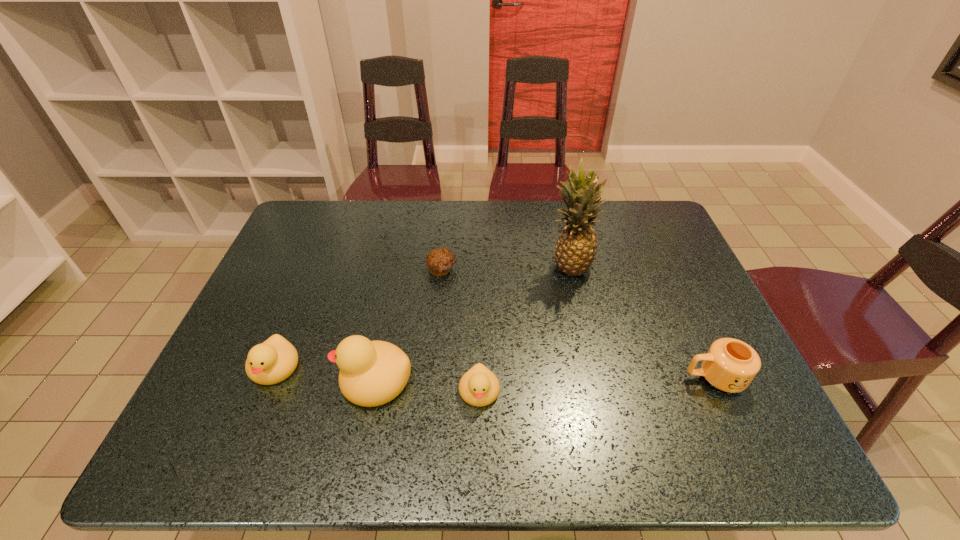
This screenshot has height=540, width=960. Find the location of `object present at the right edge`. object present at the right edge is located at coordinates (730, 365).

You are a GUI agent. You are given a task and a screenshot of the screen. Output one action in this format:
    pyautogui.click(x=<x>, y=<y>)
    Task: Click on the object that is at the near left corner
    
    Given the screenshot: What is the action you would take?
    pyautogui.click(x=273, y=361)

At what (x,y) coordinates should I click in order to perform the action: click on object present at the near right corner. Please return your answer as a coordinate pair (x, y). Looking at the image, I should click on (730, 365).

Locate an element on the screen. vacant point at the far edge is located at coordinates (352, 240).

Find the location of `vacant point at the near edge`. vacant point at the near edge is located at coordinates (586, 404).

Image resolution: width=960 pixels, height=540 pixels. In order to click on vacant space at the right edge of the desktop in this screenshot , I will do `click(650, 287)`.

Identify the location of unoccupied position between the muffin and the tallest object. This screenshot has height=540, width=960. (505, 268).

Find the location of a particular element. vacant space that is in between the second shortest object and the mug is located at coordinates (597, 384).

This screenshot has width=960, height=540. I want to click on free point between the shortest object and the leftmost duckling, so click(x=358, y=319).

The width and height of the screenshot is (960, 540). I want to click on free space that is in between the shortest object and the rightmost duckling, so click(x=461, y=330).